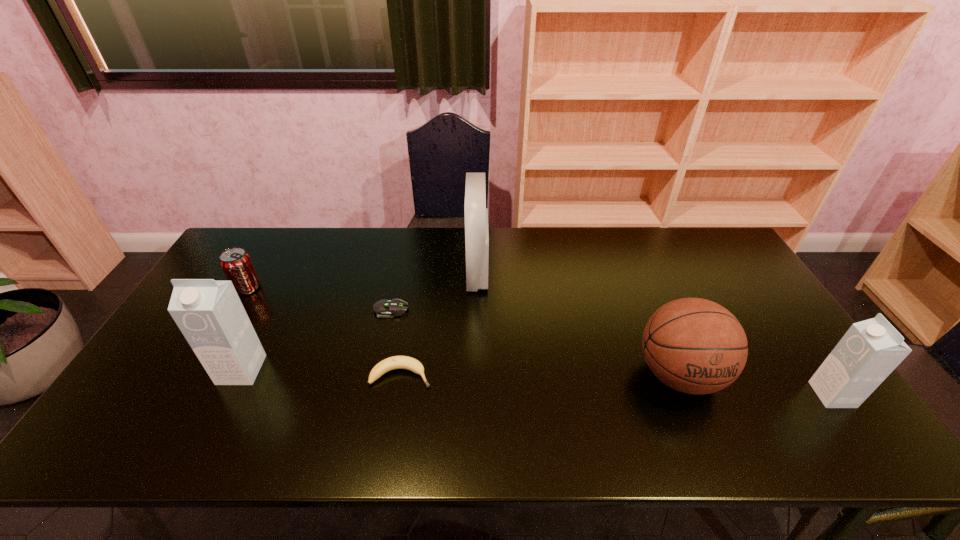
You are a GUI agent. You are given a task and a screenshot of the screen. Output one action in this format:
    pyautogui.click(x=<x>, y=<y>)
    Task: Click on the banana at the near edge
    
    Given the screenshot: What is the action you would take?
    pyautogui.click(x=396, y=362)

Where is `basketball that is positioned at the near edge`? This screenshot has height=540, width=960. basketball that is positioned at the near edge is located at coordinates (696, 346).

This screenshot has height=540, width=960. I want to click on object situated at the left edge, so click(x=236, y=263).

Where is `object positioned at the right edge`? Image resolution: width=960 pixels, height=540 pixels. object positioned at the right edge is located at coordinates (870, 350).

Locate an element on the screen. The height and width of the screenshot is (540, 960). object located at the near right corner is located at coordinates pyautogui.click(x=870, y=350).

You are a GUI agent. You are given a task and a screenshot of the screen. Output one action in this format:
    pyautogui.click(x=<x>, y=<y>)
    Task: Click on the free spot at the far edge of the desktop
    The width and height of the screenshot is (960, 540).
    Given the screenshot: What is the action you would take?
    pyautogui.click(x=316, y=243)

Image resolution: width=960 pixels, height=540 pixels. In order to click on blank space at the near edge of the desktop in this screenshot , I will do `click(377, 392)`.

Image resolution: width=960 pixels, height=540 pixels. Identify the location of blank space at the right edge of the desktop. point(797,370).

This screenshot has width=960, height=540. What are the coordinates of `vacant space at the far left corner of the desktop` in the screenshot? It's located at (249, 227).

You are a GUI agent. You are given a task and a screenshot of the screen. Output one action in this format:
    pyautogui.click(x=<x>, y=<y>)
    Task: Click on the vacant region at the near left corner of the desktop
    Image resolution: width=960 pixels, height=540 pixels.
    Given the screenshot: What is the action you would take?
    pyautogui.click(x=186, y=393)